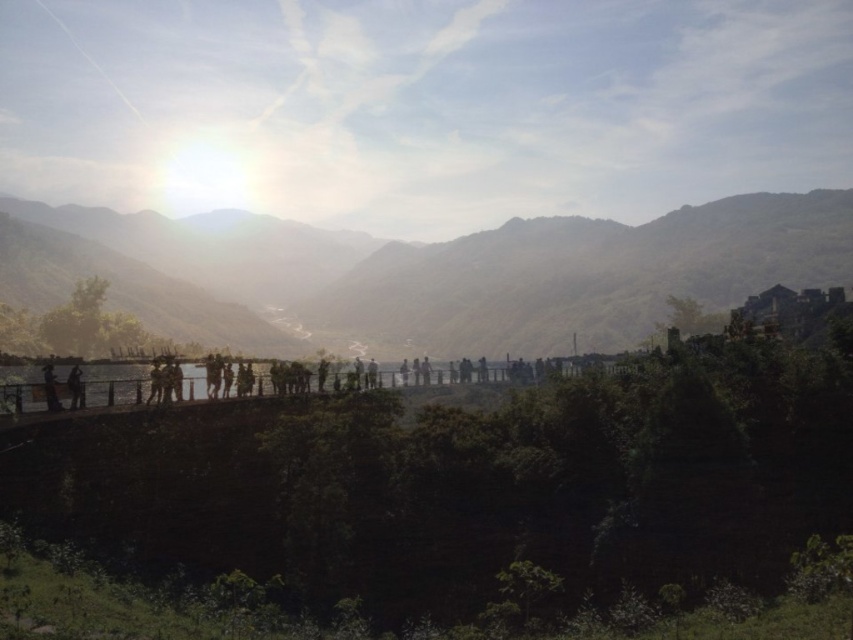
You are an observer standing in the scene. You see the green matte mountain at center and the silhouette figure at left. Which object is closer to you?

The silhouette figure at left is closer to you because the green matte mountain at center is positioned over it, indicating it is further away.

You are a hiker standing at the base of the green matte mountain at center and want to take a photo of the matte black person at lower left. Will the person be in front of or behind the mountain in the photo?

The green matte mountain at center is positioned over matte black person at lower left, so the person will be behind the mountain in the photo.

You are a photographer trying to capture a photo of the matte black person at lower left and the silhouette figure at left. Since the sun is near the horizon, you want to ensure both subjects are well lit. Which subject should you position closer to the light source to avoid underexposure?

The matte black person at lower left should be positioned closer to the light source because it is in front of the silhouette figure at left, meaning it is farther from the sun. Moving it closer would help balance the exposure between both subjects.